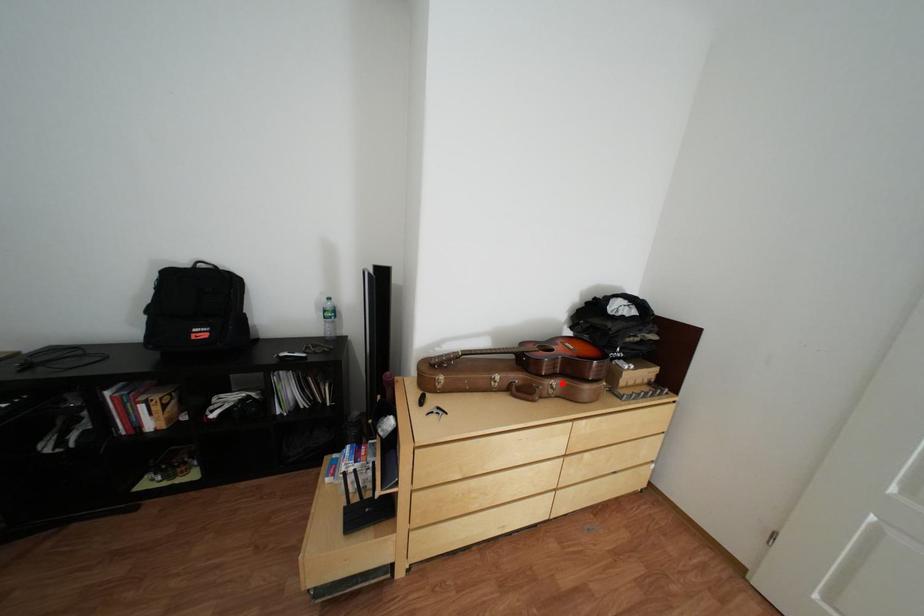
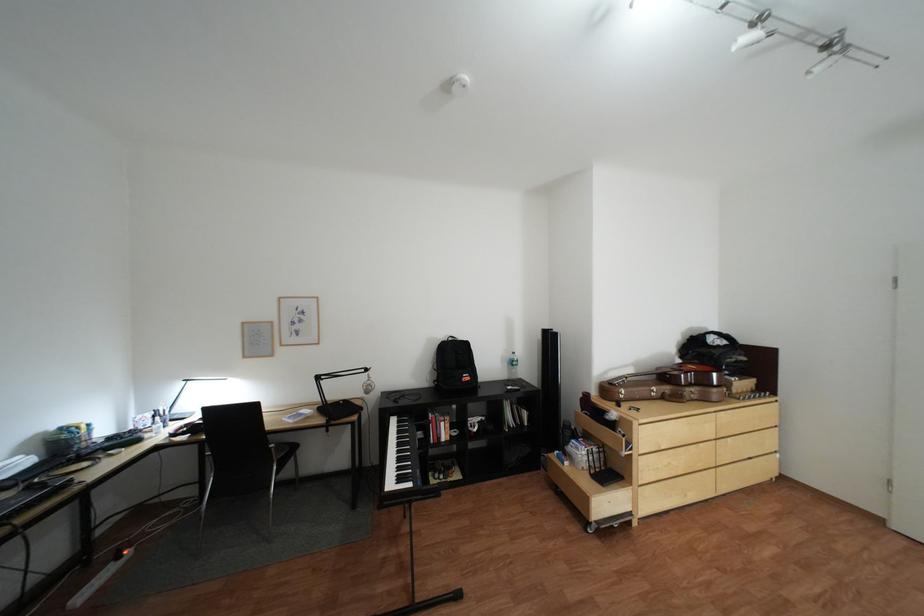
In the second image, find the point that corresponds to the highlighted location in the first image.

(703, 391)